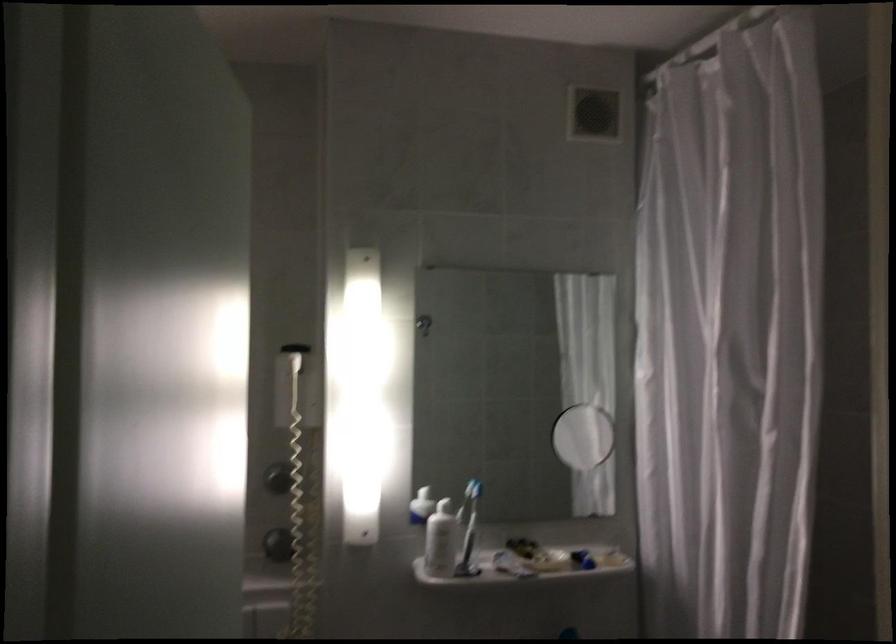
Find the location of a particular element. hair dryer handset is located at coordinates (293, 384).